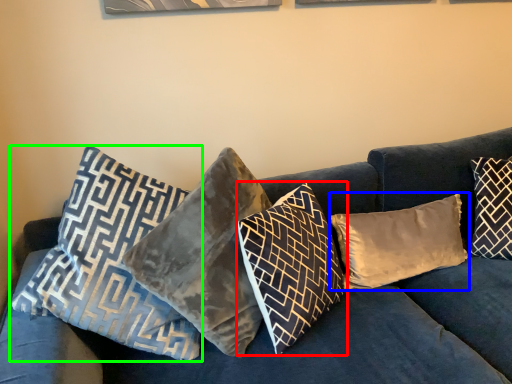
Question: Estimate the real-world distances between objects in this image. Which object is farther from pillow (highlighted by a red box), pillow (highlighted by a blue box) or pillow (highlighted by a green box)?

Choices:
 (A) pillow
 (B) pillow

Answer: (B)